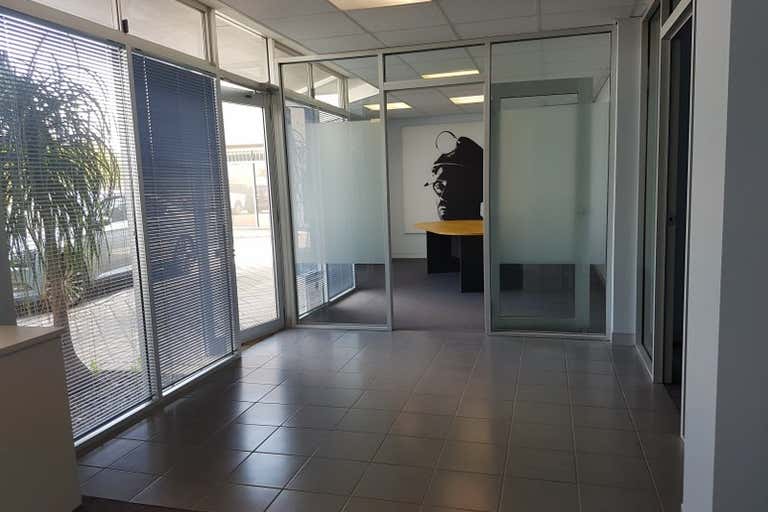
You are a GUI agent. You are given a task and a screenshot of the screen. Output one action in this format:
    pyautogui.click(x=<x>, y=<y>)
    Task: Click on the frame of office wall
    The width and height of the screenshot is (768, 512).
    Given the screenshot: What is the action you would take?
    pyautogui.click(x=394, y=53)